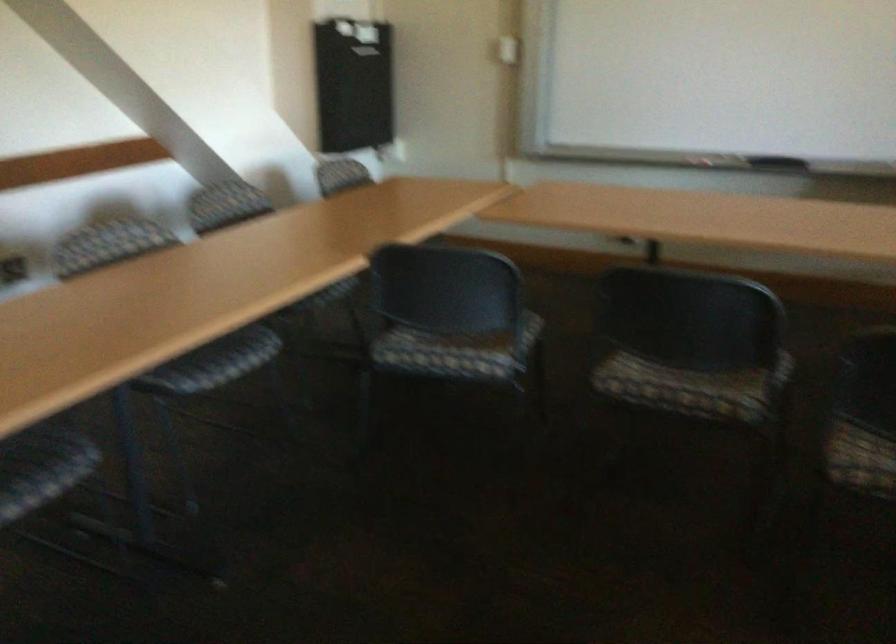
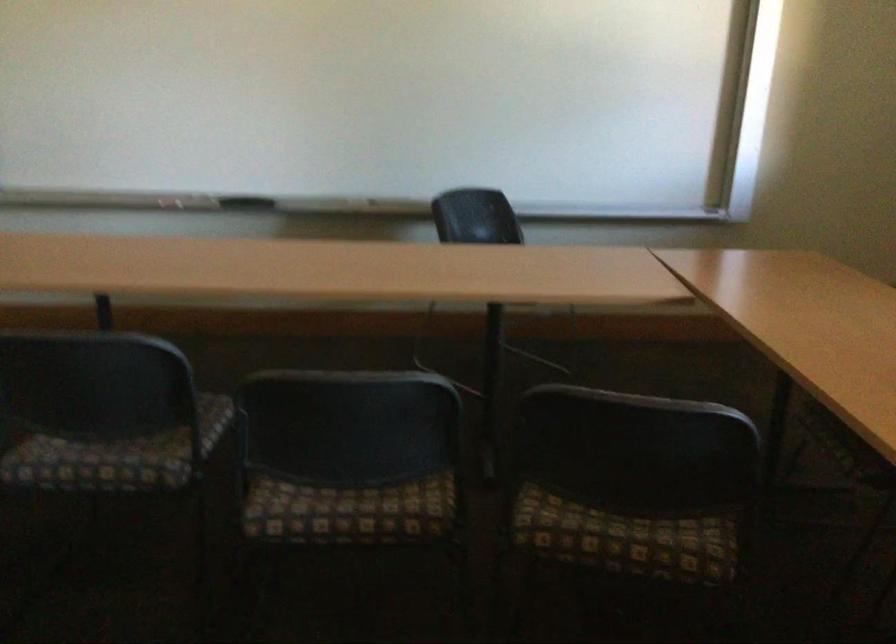
Question: The first image is from the beginning of the video and the second image is from the end. How did the camera likely rotate when shooting the video?

Choices:
 (A) Left
 (B) Right
 (C) Up
 (D) Down

Answer: (B)